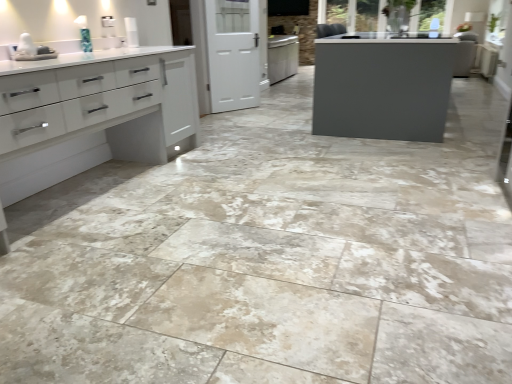
Image resolution: width=512 pixels, height=384 pixels. What are the coordinates of `free spot below white glossy cabinet at left (from a real-world perspective)` in the screenshot? It's located at (61, 200).